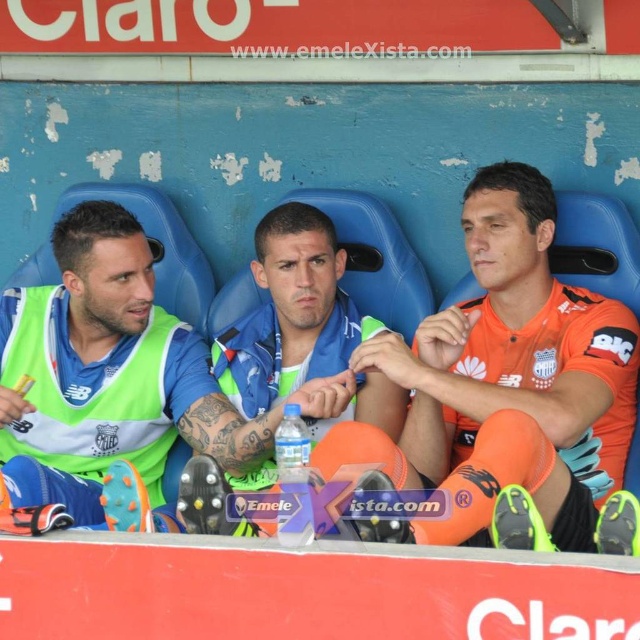
Which is below, green fabric jersey at center or blue matte jersey at center?

green fabric jersey at center is lower down.

Which is above, green fabric jersey at center or blue matte jersey at center?

Positioned higher is blue matte jersey at center.

Is point (49, 358) closer to viewer compared to point (387, 387)?

No, it is behind (387, 387).

This screenshot has height=640, width=640. In order to click on green fabric jersey at center in this screenshot , I will do `click(108, 372)`.

Is orange jersey at center wider than green fabric jersey at center?

Indeed, orange jersey at center has a greater width compared to green fabric jersey at center.

Is orange jersey at center further to camera compared to green fabric jersey at center?

No, it is not.

Is point (504, 310) positioned behind point (177, 346)?

That is False.

I want to click on orange jersey at center, so click(506, 387).

This screenshot has height=640, width=640. What do you see at coordinates (506, 387) in the screenshot?
I see `orange jersey at center` at bounding box center [506, 387].

Is orange jersey at center thinner than blue matte jersey at center?

In fact, orange jersey at center might be wider than blue matte jersey at center.

I want to click on orange jersey at center, so click(x=506, y=387).

The width and height of the screenshot is (640, 640). Find the location of `orange jersey at center`. orange jersey at center is located at coordinates (506, 387).